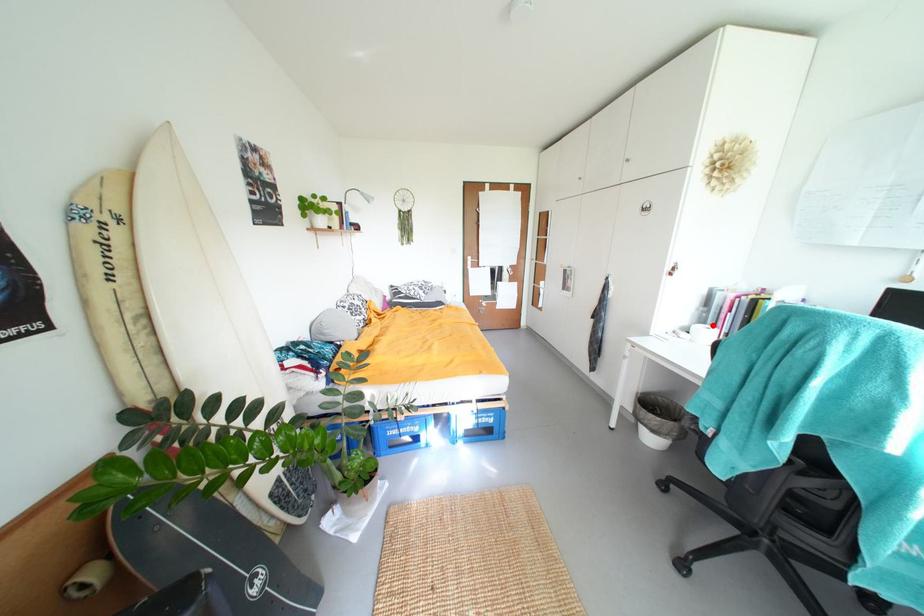
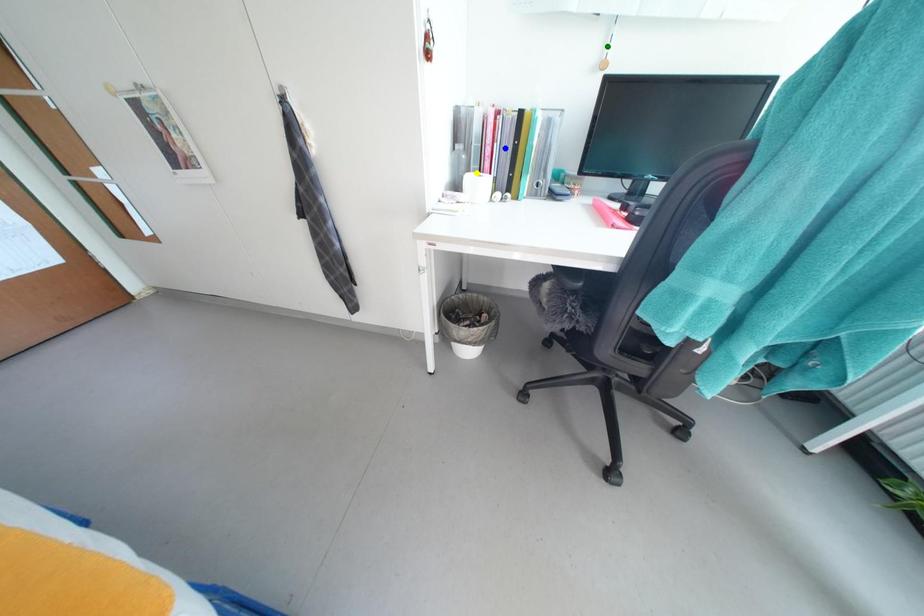
Question: I am providing you with two images of the same scene from different viewpoints. A red point is marked on the first image. You are given multiple points on the second image. Which mark in image 2 goes with the point in image 1?

Choices:
 (A) blue point
 (B) green point
 (C) yellow point

Answer: (C)